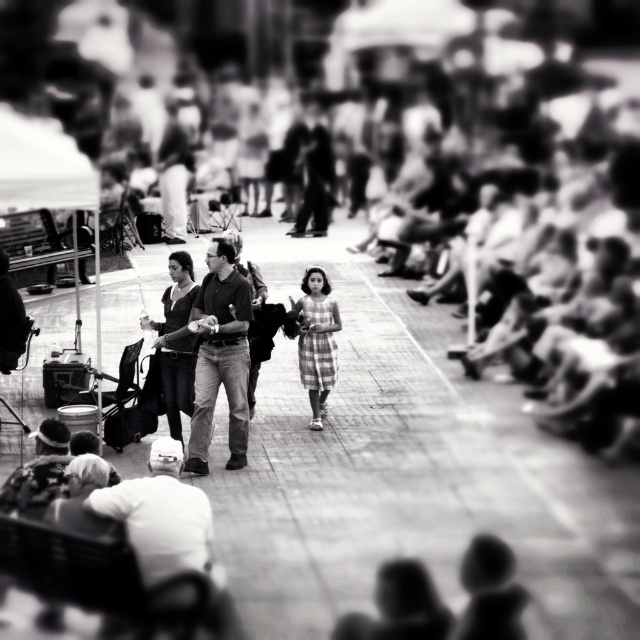
Based on the photo, you are a photographer trying to capture a clear shot of the dark gray jeans at center and the camouflage hat at lower left. Since the background is slightly blurred, which object should you focus on to ensure it appears sharp in the photo?

The dark gray jeans at center should be focused on because it is closer to the viewer than the camouflage hat at lower left, so focusing on it will keep it sharp while the background remains blurred.